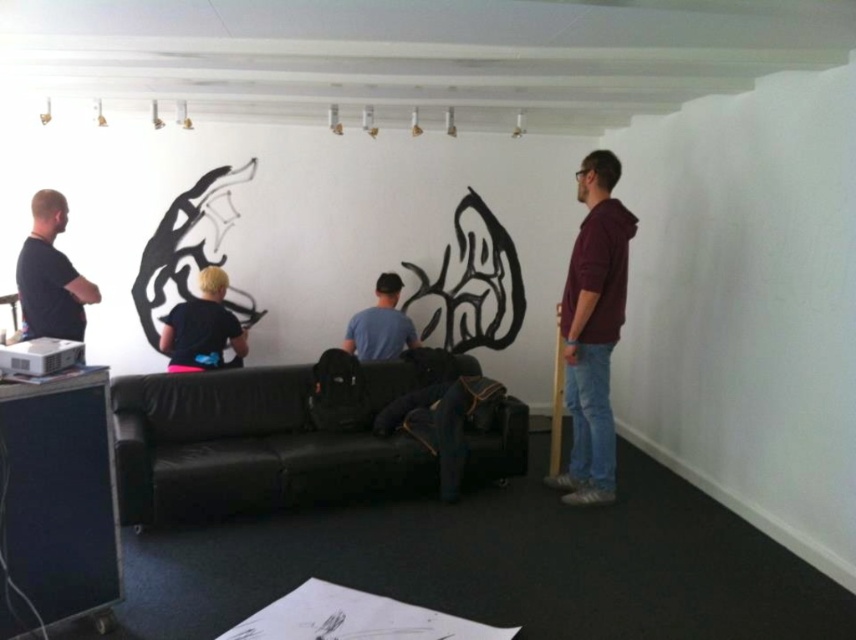
Is the position of black matte shirt at left less distant than that of blonde hair person at center?

That is True.

Does black matte shirt at left have a larger size compared to blonde hair person at center?

Actually, black matte shirt at left might be smaller than blonde hair person at center.

Between point (58, 196) and point (207, 353), which one is positioned behind?

The point (207, 353) is behind.

Locate an element on the screen. This screenshot has height=640, width=856. black matte shirt at left is located at coordinates (51, 275).

Which is behind, point (204, 340) or point (399, 339)?

Point (399, 339)

Between blonde hair person at center and matte blue shirt at center, which one appears on the left side from the viewer's perspective?

blonde hair person at center is more to the left.

Which is in front, point (169, 316) or point (361, 323)?

Point (169, 316) is more forward.

Locate an element on the screen. This screenshot has height=640, width=856. blonde hair person at center is located at coordinates (201, 326).

Who is more forward, (x=337, y=500) or (x=76, y=285)?

Point (x=76, y=285)

Does black leather couch at center come in front of black matte shirt at left?

Yes, it is.

Does point (497, 477) come in front of point (40, 211)?

That is False.

Locate an element on the screen. The image size is (856, 640). black leather couch at center is located at coordinates (254, 444).